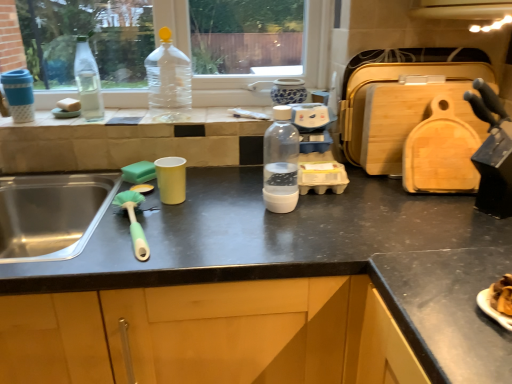
Identify the location of green sponge at left, marked as the first food in a front-to-back arrangement. The image size is (512, 384). (139, 172).

This screenshot has height=384, width=512. What do you see at coordinates (139, 172) in the screenshot?
I see `green sponge at left, arranged as the 2th food when viewed from the back` at bounding box center [139, 172].

The height and width of the screenshot is (384, 512). What do you see at coordinates (69, 105) in the screenshot?
I see `white sponge at left, positioned as the first food in left-to-right order` at bounding box center [69, 105].

Locate an element on the screen. The width and height of the screenshot is (512, 384). translucent glass bottle at upper center is located at coordinates (80, 119).

Can you confirm if translucent glass bottle at upper center is shorter than transparent plastic bottle at center, arranged as the first bottle when viewed from the front?

Indeed, translucent glass bottle at upper center has a lesser height compared to transparent plastic bottle at center, arranged as the first bottle when viewed from the front.

Is translucent glass bottle at upper center facing away from transparent plastic bottle at center, arranged as the third bottle when viewed from the back?

No, translucent glass bottle at upper center is not facing the opposite direction of transparent plastic bottle at center, arranged as the third bottle when viewed from the back.

Is translucent glass bottle at upper center in front of or behind transparent plastic bottle at center, the first bottle from the right, in the image?

In the image, translucent glass bottle at upper center appears behind transparent plastic bottle at center, the first bottle from the right.

Considering the relative sizes of translucent glass bottle at upper center and transparent plastic bottle at center, acting as the 3th bottle starting from the left, in the image provided, is translucent glass bottle at upper center smaller than transparent plastic bottle at center, acting as the 3th bottle starting from the left,?

No.

Is white sponge at left, placed as the first food when sorted from back to front, placed right next to transparent plastic bottle at center, acting as the 3th bottle starting from the left?

No, white sponge at left, placed as the first food when sorted from back to front, is not touching transparent plastic bottle at center, acting as the 3th bottle starting from the left.

Is white sponge at left, the first food in the top-to-bottom sequence, positioned with its back to transparent plastic bottle at center, acting as the 3th bottle starting from the left?

No, white sponge at left, the first food in the top-to-bottom sequence, is not facing the opposite direction of transparent plastic bottle at center, acting as the 3th bottle starting from the left.

Considering the relative sizes of white sponge at left, which is counted as the second food, starting from the bottom, and transparent plastic bottle at center, acting as the 3th bottle starting from the left, in the image provided, is white sponge at left, which is counted as the second food, starting from the bottom, thinner than transparent plastic bottle at center, acting as the 3th bottle starting from the left,?

Yes, white sponge at left, which is counted as the second food, starting from the bottom, is thinner than transparent plastic bottle at center, acting as the 3th bottle starting from the left.

How much distance is there between white sponge at left, positioned as the first food in left-to-right order, and transparent plastic bottle at center, arranged as the third bottle when viewed from the back?

white sponge at left, positioned as the first food in left-to-right order, and transparent plastic bottle at center, arranged as the third bottle when viewed from the back, are 30.53 inches apart from each other.

From the image's perspective, who appears lower, green sponge at left, placed as the second food when sorted from left to right, or translucent glass bottle at upper center?

From the image's view, green sponge at left, placed as the second food when sorted from left to right, is below.

In terms of height, does green sponge at left, placed as the second food when sorted from left to right, look taller or shorter compared to translucent glass bottle at upper center?

Considering their sizes, green sponge at left, placed as the second food when sorted from left to right, has more height than translucent glass bottle at upper center.

You are a GUI agent. You are given a task and a screenshot of the screen. Output one action in this format:
    pyautogui.click(x=<x>, y=<y>)
    Task: Click on the food that is the 1st one when counting leftward from the translucent glass bottle at upper center
    This screenshot has width=512, height=384.
    Given the screenshot: What is the action you would take?
    pyautogui.click(x=139, y=172)

From a real-world perspective, is green sponge at left, the 1th food from the bottom, physically located above or below translucent glass bottle at upper center?

In terms of real-world spatial position, green sponge at left, the 1th food from the bottom, is below translucent glass bottle at upper center.

Is matte black countertop at center oriented towards green sponge at left, the 1th food from the bottom?

No, matte black countertop at center is not turned towards green sponge at left, the 1th food from the bottom.

Is matte black countertop at center wider or thinner than green sponge at left, which ranks as the 2th food in top-to-bottom order?

Considering their sizes, matte black countertop at center looks broader than green sponge at left, which ranks as the 2th food in top-to-bottom order.

Is point (84, 47) positioned behind point (126, 173)?

Yes, point (84, 47) is farther from viewer.

Does clear glass bottle at left, which is the third bottle in front-to-back order, touch green sponge at left, arranged as the first food when viewed from the right?

No.

Does clear glass bottle at left, the 1th bottle from the back, have a larger size compared to green sponge at left, arranged as the first food when viewed from the right?

Yes, clear glass bottle at left, the 1th bottle from the back, is bigger than green sponge at left, arranged as the first food when viewed from the right.

From the image's perspective, is clear glass bottle at left, the 1th bottle from the back, over green sponge at left, which ranks as the 2th food in top-to-bottom order?

Indeed, from the image's perspective, clear glass bottle at left, the 1th bottle from the back, is shown above green sponge at left, which ranks as the 2th food in top-to-bottom order.

Considering the positions of objects green plastic brush at left and translucent glass bottle at upper center in the image provided, who is in front, green plastic brush at left or translucent glass bottle at upper center?

green plastic brush at left is closer to the camera.

Choose the correct answer: Is green plastic brush at left inside translucent glass bottle at upper center or outside it?

green plastic brush at left lies outside translucent glass bottle at upper center.

Which object is positioned more to the left, green plastic brush at left or translucent glass bottle at upper center?

translucent glass bottle at upper center.

Does green plastic brush at left have a larger size compared to translucent glass bottle at upper center?

No, green plastic brush at left is not bigger than translucent glass bottle at upper center.

Considering the positions of points (66, 98) and (258, 124), is point (66, 98) closer to camera compared to point (258, 124)?

No, (66, 98) is behind (258, 124).

Which food is the 2nd one when counting from the left side of the translucent glass bottle at upper center? Please provide its 2D coordinates.

[(69, 105)]

What's the angular difference between white sponge at left, the first food in the top-to-bottom sequence, and translucent glass bottle at upper center's facing directions?

The angle between the facing direction of white sponge at left, the first food in the top-to-bottom sequence, and the facing direction of translucent glass bottle at upper center is 45.2 degrees.

How distant is white sponge at left, positioned as the first food in left-to-right order, from translucent glass bottle at upper center?

The distance of white sponge at left, positioned as the first food in left-to-right order, from translucent glass bottle at upper center is 11.75 inches.

The image size is (512, 384). I want to click on window sill lying on the left of transparent plastic bottle at center, arranged as the first bottle when viewed from the front, so click(80, 119).

The image size is (512, 384). In order to click on bottle that appears below the white sponge at left, positioned as the first food in left-to-right order (from the image's perspective) in this screenshot , I will do coord(281,162).

Based on their spatial positions, is green sponge at left, marked as the first food in a front-to-back arrangement, or transparent plastic bottle at upper center, the 2th bottle from the back, further from translucent glass bottle at upper center?

green sponge at left, marked as the first food in a front-to-back arrangement, lies further to translucent glass bottle at upper center than the other object.

Looking at the image, which one is located further to green plastic brush at left, transparent plastic bottle at upper center, the second bottle when ordered from left to right, or clear glass bottle at left, which is the third bottle in front-to-back order?

Among the two, clear glass bottle at left, which is the third bottle in front-to-back order, is located further to green plastic brush at left.

Based on the photo, considering their positions, is translucent glass bottle at upper center positioned closer to green sponge at left, marked as the first food in a front-to-back arrangement, than transparent plastic bottle at upper center, the 2th bottle from the back?

translucent glass bottle at upper center is positioned closer to the anchor green sponge at left, marked as the first food in a front-to-back arrangement.

When comparing their distances from clear glass bottle at left, the 1th bottle from the back, does green plastic brush at left or transparent plastic bottle at center, the first bottle from the right, seem closer?

green plastic brush at left lies closer to clear glass bottle at left, the 1th bottle from the back, than the other object.

From the image, which object appears to be nearer to clear glass bottle at left, which is counted as the 1th bottle, starting from the left, transparent plastic bottle at upper center, the 2th bottle from the back, or white sponge at left, positioned as the first food in left-to-right order?

white sponge at left, positioned as the first food in left-to-right order, is positioned closer to the anchor clear glass bottle at left, which is counted as the 1th bottle, starting from the left.

When comparing their distances from matte black countertop at center, does clear glass bottle at left, the 1th bottle from the back, or green plastic brush at left seem further?

clear glass bottle at left, the 1th bottle from the back, is further to matte black countertop at center.

Which object lies nearer to the anchor point matte black countertop at center, green plastic brush at left or transparent plastic bottle at upper center, the 2th bottle from the back?

green plastic brush at left lies closer to matte black countertop at center than the other object.

Considering their positions, is clear glass bottle at left, which is counted as the 1th bottle, starting from the left, positioned further to matte black countertop at center than transparent plastic bottle at upper center, arranged as the second bottle when viewed from the front?

Based on the image, clear glass bottle at left, which is counted as the 1th bottle, starting from the left, appears to be further to matte black countertop at center.

Find the location of a particular element. The width and height of the screenshot is (512, 384). brush between green sponge at left, marked as the first food in a front-to-back arrangement, and transparent plastic bottle at center, the first bottle from the right, in the horizontal direction is located at coordinates (134, 222).

Find the location of a particular element. The image size is (512, 384). window sill between transparent plastic bottle at upper center, the 2th bottle from the back, and matte black countertop at center, in the vertical direction is located at coordinates (80, 119).

Where is `window sill positioned between green plastic brush at left and white sponge at left, which is counted as the second food, starting from the bottom, from near to far`? window sill positioned between green plastic brush at left and white sponge at left, which is counted as the second food, starting from the bottom, from near to far is located at coordinates (80, 119).

At what (x,y) coordinates should I click in order to perform the action: click on bottle between clear glass bottle at left, the 1th bottle from the back, and matte black countertop at center in the up-down direction. Please return your answer as a coordinate pair (x, y). This screenshot has width=512, height=384. Looking at the image, I should click on (281, 162).